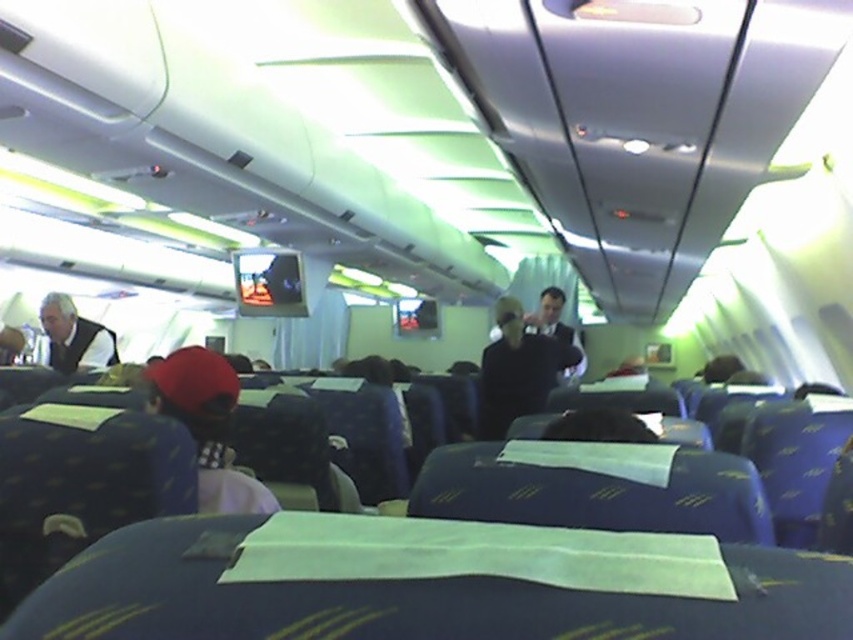
Is dark blue fabric jacket at center below white shirt at left?

Yes.

Is dark blue fabric jacket at center shorter than white shirt at left?

Incorrect, dark blue fabric jacket at center's height does not fall short of white shirt at left's.

Which is behind, point (498, 417) or point (84, 324)?

Positioned behind is point (84, 324).

This screenshot has width=853, height=640. What are the coordinates of `dark blue fabric jacket at center` in the screenshot? It's located at (518, 369).

Is point (543, 348) positioned after point (543, 298)?

That is False.

Does dark blue fabric jacket at center appear under dark blue suit at center?

Indeed, dark blue fabric jacket at center is positioned under dark blue suit at center.

Which is in front, point (523, 332) or point (538, 308)?

Point (523, 332) is in front.

Image resolution: width=853 pixels, height=640 pixels. Identify the location of dark blue fabric jacket at center. (518, 369).

Who is more forward, [200,488] or [112,333]?

Point [200,488] is more forward.

Does red fabric cap at left appear under white shirt at left?

Indeed, red fabric cap at left is positioned under white shirt at left.

Who is more distant from viewer, (x=195, y=388) or (x=97, y=348)?

The point (x=97, y=348) is more distant.

At what (x,y) coordinates should I click in order to perform the action: click on red fabric cap at left. Please return your answer as a coordinate pair (x, y). Looking at the image, I should click on (207, 426).